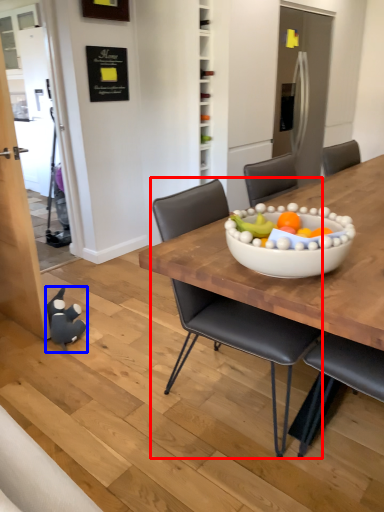
Question: Which of the following is the closest to the observer, chair (highlighted by a red box) or toy (highlighted by a blue box)?

Choices:
 (A) chair
 (B) toy

Answer: (A)